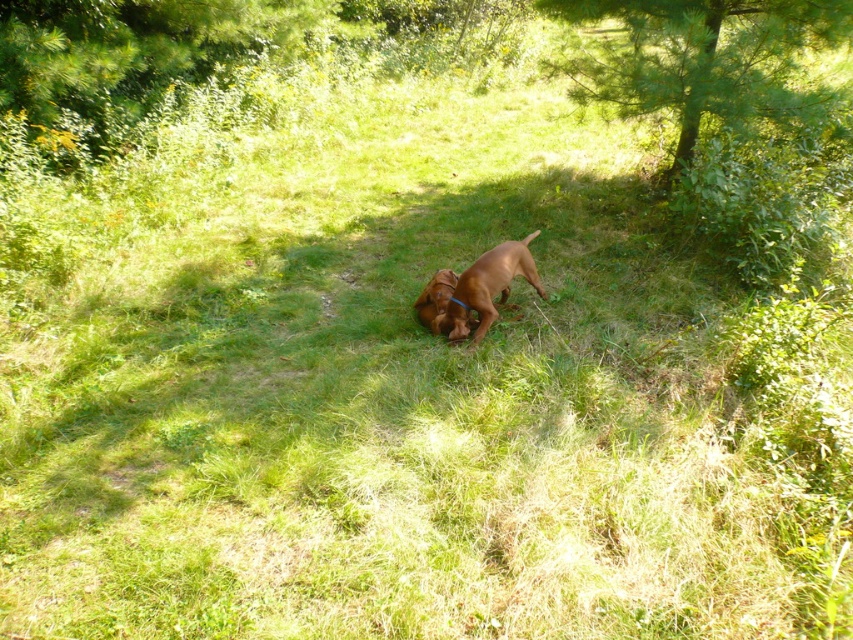
Between green leafy tree at upper right and brown glossy dog at center, which one is positioned lower?

Positioned lower is brown glossy dog at center.

Does green leafy tree at upper right have a greater width compared to brown glossy dog at center?

Yes.

I want to click on green leafy tree at upper right, so point(706,60).

This screenshot has width=853, height=640. Find the location of `green leafy tree at upper right`. green leafy tree at upper right is located at coordinates (706, 60).

Between brown glossy dog at center and brown furry dog at center, which one has less height?

brown furry dog at center is shorter.

Measure the distance between brown glossy dog at center and camera.

brown glossy dog at center is 4.14 meters away from camera.

Where is `brown glossy dog at center`? The image size is (853, 640). brown glossy dog at center is located at coordinates (486, 289).

Locate an element on the screen. Image resolution: width=853 pixels, height=640 pixels. brown glossy dog at center is located at coordinates (486, 289).

Where is `green leafy tree at upper right`? The height and width of the screenshot is (640, 853). green leafy tree at upper right is located at coordinates (706, 60).